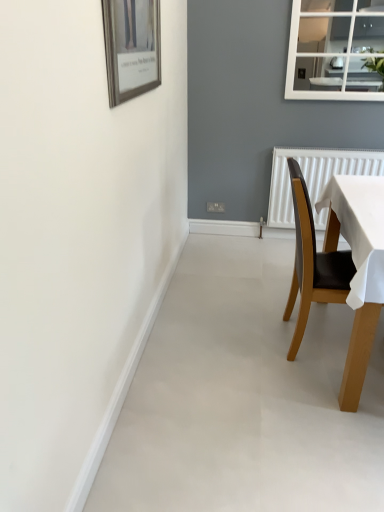
This screenshot has height=512, width=384. What are the coordinates of `brown wooden chair at right` in the screenshot? It's located at (314, 260).

This screenshot has width=384, height=512. What do you see at coordinates (314, 260) in the screenshot?
I see `brown wooden chair at right` at bounding box center [314, 260].

This screenshot has width=384, height=512. Identify the location of wooden-framed picture at upper left. (131, 47).

What is the approximate width of wooden-framed picture at upper left?

It is 1.70 inches.

Describe the element at coordinates (131, 47) in the screenshot. I see `wooden-framed picture at upper left` at that location.

Where is `brown wooden chair at right`? The height and width of the screenshot is (512, 384). brown wooden chair at right is located at coordinates (314, 260).

Considering the positions of objects brown wooden chair at right and wooden-framed picture at upper left in the image provided, who is more to the right, brown wooden chair at right or wooden-framed picture at upper left?

From the viewer's perspective, brown wooden chair at right appears more on the right side.

Is brown wooden chair at right positioned in front of wooden-framed picture at upper left?

No, brown wooden chair at right is further to the viewer.

Is point (331, 254) closer to camera compared to point (118, 95)?

That is False.

From the image's perspective, which object appears higher, brown wooden chair at right or wooden-framed picture at upper left?

From the image's view, wooden-framed picture at upper left is above.

From a real-world perspective, is brown wooden chair at right located higher than wooden-framed picture at upper left?

No, from a real-world perspective, brown wooden chair at right is not over wooden-framed picture at upper left

Which object is thinner, brown wooden chair at right or wooden-framed picture at upper left?

With smaller width is wooden-framed picture at upper left.

Who is shorter, brown wooden chair at right or wooden-framed picture at upper left?

Standing shorter between the two is wooden-framed picture at upper left.

Can you confirm if brown wooden chair at right is smaller than wooden-framed picture at upper left?

Incorrect, brown wooden chair at right is not smaller in size than wooden-framed picture at upper left.

Would you say brown wooden chair at right is outside wooden-framed picture at upper left?

Absolutely, brown wooden chair at right is external to wooden-framed picture at upper left.

Are brown wooden chair at right and wooden-framed picture at upper left far apart?

They are positioned close to each other.

Could you tell me if brown wooden chair at right is facing wooden-framed picture at upper left?

No, brown wooden chair at right is not oriented towards wooden-framed picture at upper left.

How far apart are brown wooden chair at right and wooden-framed picture at upper left?

They are 38.55 inches apart.

Find the location of `chair on the right of wooden-framed picture at upper left`. chair on the right of wooden-framed picture at upper left is located at coordinates (314, 260).

Which object is positioned more to the right, wooden-framed picture at upper left or brown wooden chair at right?

From the viewer's perspective, brown wooden chair at right appears more on the right side.

Does wooden-framed picture at upper left lie in front of brown wooden chair at right?

Yes, it is.

Which is less distant, (130, 90) or (295, 263)?

The point (130, 90) is in front.

From the image's perspective, which object appears higher, wooden-framed picture at upper left or brown wooden chair at right?

wooden-framed picture at upper left appears higher in the image.

From a real-world perspective, which is physically above, wooden-framed picture at upper left or brown wooden chair at right?

In real-world perspective, wooden-framed picture at upper left is above.

Does wooden-framed picture at upper left have a lesser width compared to brown wooden chair at right?

Yes.

Between wooden-framed picture at upper left and brown wooden chair at right, which one has less height?

Standing shorter between the two is wooden-framed picture at upper left.

Considering the relative sizes of wooden-framed picture at upper left and brown wooden chair at right in the image provided, is wooden-framed picture at upper left smaller than brown wooden chair at right?

Indeed, wooden-framed picture at upper left has a smaller size compared to brown wooden chair at right.

Can brown wooden chair at right be found inside wooden-framed picture at upper left?

That's incorrect, brown wooden chair at right is not inside wooden-framed picture at upper left.

Is wooden-framed picture at upper left next to brown wooden chair at right and touching it?

No, wooden-framed picture at upper left is not beside brown wooden chair at right.

Is wooden-framed picture at upper left facing away from brown wooden chair at right?

wooden-framed picture at upper left is not turned away from brown wooden chair at right.

In the scene shown: How many degrees apart are the facing directions of wooden-framed picture at upper left and brown wooden chair at right?

2.05 degrees.

The height and width of the screenshot is (512, 384). In order to click on chair that is below the wooden-framed picture at upper left (from the image's perspective) in this screenshot , I will do `click(314, 260)`.

This screenshot has height=512, width=384. I want to click on chair located behind the wooden-framed picture at upper left, so click(x=314, y=260).

At what (x,y) coordinates should I click in order to perform the action: click on picture frame above the brown wooden chair at right (from the image's perspective). Please return your answer as a coordinate pair (x, y). The image size is (384, 512). Looking at the image, I should click on (131, 47).